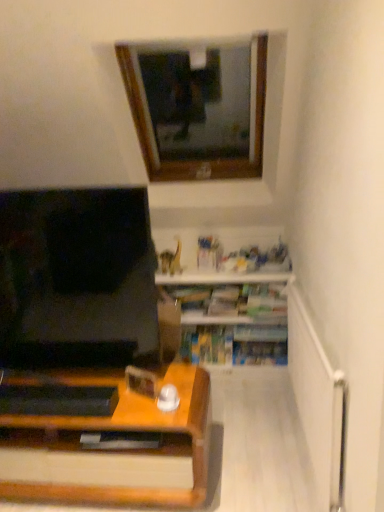
Locate an element on the screen. vacant area that is in front of white glossy shelf at lower center is located at coordinates (255, 421).